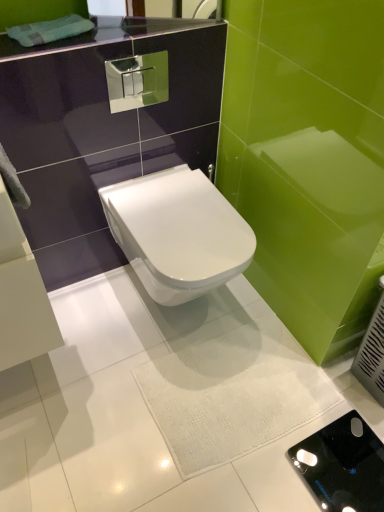
Question: Is white glossy toilet at center to the left of black glossy porcelain at center from the viewer's perspective?

Choices:
 (A) yes
 (B) no

Answer: (A)

Question: Considering the relative sizes of white glossy toilet at center and black glossy porcelain at center in the image provided, is white glossy toilet at center taller than black glossy porcelain at center?

Choices:
 (A) no
 (B) yes

Answer: (B)

Question: Does white glossy toilet at center lie behind black glossy porcelain at center?

Choices:
 (A) yes
 (B) no

Answer: (B)

Question: Is the position of white glossy toilet at center less distant than that of black glossy porcelain at center?

Choices:
 (A) yes
 (B) no

Answer: (A)

Question: Could you tell me if white glossy toilet at center is facing black glossy porcelain at center?

Choices:
 (A) no
 (B) yes

Answer: (B)

Question: Are white glossy toilet at center and black glossy porcelain at center located far from each other?

Choices:
 (A) yes
 (B) no

Answer: (B)

Question: From the image's perspective, does black glossy porcelain at center appear lower than white glossy toilet at center?

Choices:
 (A) no
 (B) yes

Answer: (B)

Question: Can you confirm if black glossy porcelain at center is positioned to the left of white glossy toilet at center?

Choices:
 (A) no
 (B) yes

Answer: (A)

Question: Is black glossy porcelain at center further to camera compared to white glossy toilet at center?

Choices:
 (A) no
 (B) yes

Answer: (B)

Question: Is black glossy porcelain at center beside white glossy toilet at center?

Choices:
 (A) yes
 (B) no

Answer: (B)

Question: Is the position of black glossy porcelain at center less distant than that of white glossy toilet at center?

Choices:
 (A) yes
 (B) no

Answer: (B)

Question: Are black glossy porcelain at center and white glossy toilet at center far apart?

Choices:
 (A) no
 (B) yes

Answer: (A)

Question: Considering the positions of white glossy toilet at center and black glossy porcelain at center in the image, is white glossy toilet at center bigger or smaller than black glossy porcelain at center?

Choices:
 (A) small
 (B) big

Answer: (B)